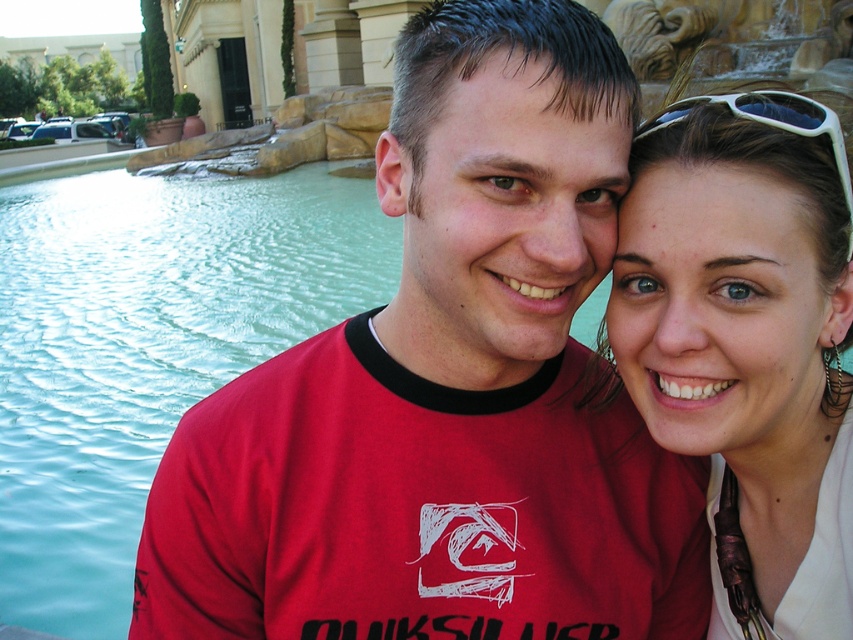
Question: Does white matte sunglasses at upper right have a larger size compared to white plastic sunglasses at upper right?

Choices:
 (A) yes
 (B) no

Answer: (A)

Question: Is matte red t-shirt at center wider than white matte sunglasses at upper right?

Choices:
 (A) yes
 (B) no

Answer: (A)

Question: Which point is closer to the camera?

Choices:
 (A) (51, 586)
 (B) (712, 182)
 (C) (610, 548)

Answer: (B)

Question: Estimate the real-world distances between objects in this image. Which object is closer to the matte red t-shirt at center?

Choices:
 (A) clear blue water at center
 (B) white matte sunglasses at upper right
 (C) white plastic sunglasses at upper right

Answer: (B)

Question: Which of these objects is positioned farthest from the white plastic sunglasses at upper right?

Choices:
 (A) white matte sunglasses at upper right
 (B) matte red t-shirt at center
 (C) clear blue water at center

Answer: (C)

Question: Does matte red t-shirt at center have a greater width compared to white plastic sunglasses at upper right?

Choices:
 (A) no
 (B) yes

Answer: (B)